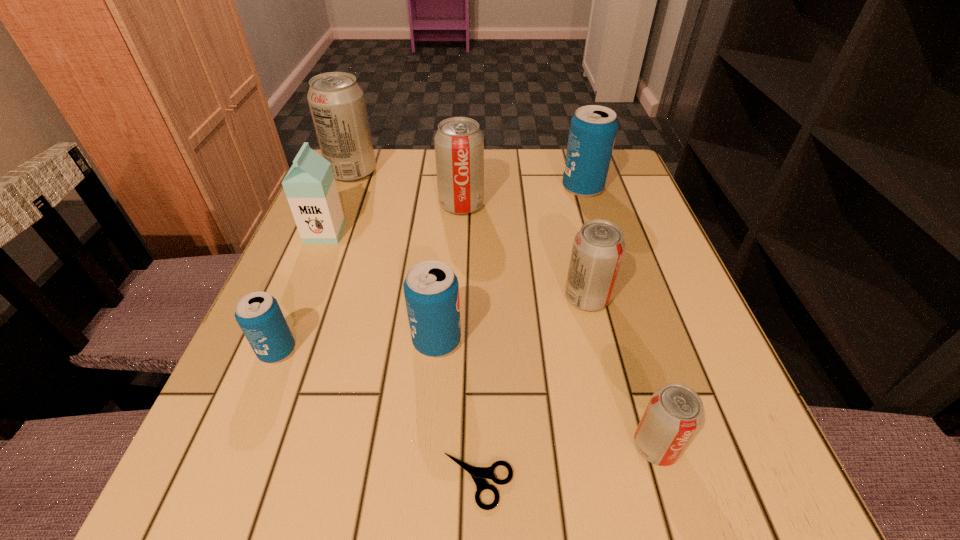
At what (x,y) coordinates should I click in order to perform the action: click on the second smallest blue soda can. Please return your answer as a coordinate pair (x, y). The width and height of the screenshot is (960, 540). Looking at the image, I should click on (431, 289).

Where is `the leftmost blue soda can`? This screenshot has width=960, height=540. the leftmost blue soda can is located at coordinates (258, 314).

The image size is (960, 540). I want to click on the smallest gray soda can, so click(674, 413).

Where is `the nearest soda can`? This screenshot has height=540, width=960. the nearest soda can is located at coordinates (674, 413).

Identify the location of the shortest object. The image size is (960, 540). (479, 474).

At what (x,y) coordinates should I click in order to perform the action: click on vacant space located 0.310m on the right of the tallest soda can. Please return your answer as a coordinate pair (x, y). Image resolution: width=960 pixels, height=540 pixels. Looking at the image, I should click on coord(497,172).

Identify the location of blank space located on the front of the farthest blue soda can. (590, 215).

Locate an element on the screen. Image resolution: width=960 pixels, height=540 pixels. free location located on the left of the third nearest gray soda can is located at coordinates pyautogui.click(x=336, y=205).

This screenshot has height=540, width=960. I want to click on vacant area situated on the front of the fourth farthest object, so click(x=280, y=342).

Locate an element on the screen. The width and height of the screenshot is (960, 540). blank area located on the left of the fourth nearest soda can is located at coordinates point(375,298).